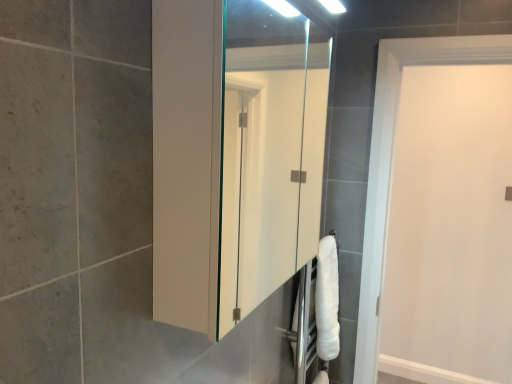
What do you see at coordinates (450, 228) in the screenshot?
I see `white matte door at right` at bounding box center [450, 228].

Find the location of a particular element. white matte door at right is located at coordinates (450, 228).

Describe the element at coordinates (270, 152) in the screenshot. Image resolution: width=512 pixels, height=384 pixels. I see `white glossy cabinet at center` at that location.

Find the location of a particular element. The width and height of the screenshot is (512, 384). white glossy cabinet at center is located at coordinates (270, 152).

Identify the location of white matte door at right. (450, 228).

Considering the relative positions of white glossy cabinet at center and white matte door at right in the image provided, is white glossy cabinet at center to the right of white matte door at right from the viewer's perspective?

No, white glossy cabinet at center is not to the right of white matte door at right.

From the picture: Does white glossy cabinet at center lie behind white matte door at right?

That is False.

Which is further, [329,46] or [496,96]?

The point [496,96] is behind.

From the image's perspective, would you say white glossy cabinet at center is shown under white matte door at right?

No.

From a real-world perspective, who is located lower, white glossy cabinet at center or white matte door at right?

white matte door at right is physically lower.

Considering the sizes of objects white glossy cabinet at center and white matte door at right in the image provided, who is thinner, white glossy cabinet at center or white matte door at right?

Thinner between the two is white matte door at right.

Can you confirm if white glossy cabinet at center is shorter than white matte door at right?

Yes, white glossy cabinet at center is shorter than white matte door at right.

Considering the sizes of white glossy cabinet at center and white matte door at right in the image, is white glossy cabinet at center bigger or smaller than white matte door at right?

In the image, white glossy cabinet at center appears to be smaller than white matte door at right.

Would you say white glossy cabinet at center is inside or outside white matte door at right?

white glossy cabinet at center is not inside white matte door at right, it's outside.

Consider the image. Is white glossy cabinet at center positioned far away from white matte door at right?

white glossy cabinet at center is actually quite close to white matte door at right.

From the picture: Is white glossy cabinet at center positioned with its back to white matte door at right?

That's not correct — white glossy cabinet at center is not looking away from white matte door at right.

This screenshot has width=512, height=384. Identify the location of door to the right of white glossy cabinet at center. (450, 228).

Which is more to the left, white matte door at right or white glossy cabinet at center?

Positioned to the left is white glossy cabinet at center.

Does white matte door at right come behind white glossy cabinet at center?

That is True.

Does point (413, 321) lie behind point (247, 103)?

No, (413, 321) is in front of (247, 103).

From the image's perspective, who appears lower, white matte door at right or white glossy cabinet at center?

From the image's view, white matte door at right is below.

From a real-world perspective, is white matte door at right over white glossy cabinet at center?

No, from a real-world perspective, white matte door at right is not on top of white glossy cabinet at center.

Can you confirm if white matte door at right is thinner than white glossy cabinet at center?

Indeed, white matte door at right has a lesser width compared to white glossy cabinet at center.

Can you confirm if white matte door at right is taller than white glossy cabinet at center?

Correct, white matte door at right is much taller as white glossy cabinet at center.

Considering the relative sizes of white matte door at right and white glossy cabinet at center in the image provided, is white matte door at right bigger than white glossy cabinet at center?

Yes.

From the picture: Is white matte door at right surrounding white glossy cabinet at center?

No.

Is white matte door at right in contact with white glossy cabinet at center?

No, white matte door at right is not touching white glossy cabinet at center.

Based on the photo, is white glossy cabinet at center at the back of white matte door at right?

No, white matte door at right is not facing the opposite direction of white glossy cabinet at center.

How far apart are white matte door at right and white glossy cabinet at center?

white matte door at right is 34.41 inches from white glossy cabinet at center.

Identify the location of mirror that appears in front of the white matte door at right. (270, 152).

Find the location of a particular element. This screenshot has height=384, width=512. door lying on the right of white glossy cabinet at center is located at coordinates (450, 228).

Where is `door below the white glossy cabinet at center (from a real-world perspective)`? door below the white glossy cabinet at center (from a real-world perspective) is located at coordinates (450, 228).